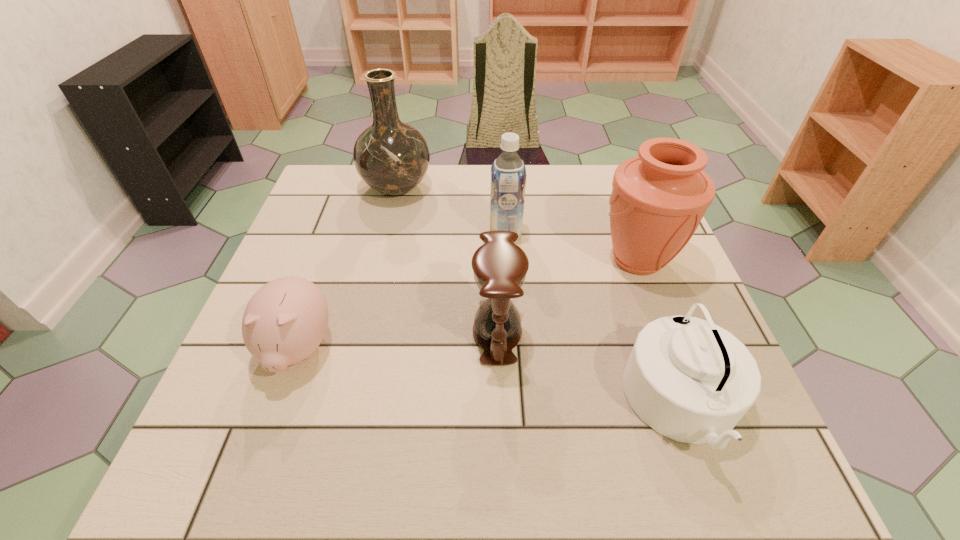
Image resolution: width=960 pixels, height=540 pixels. I want to click on free location at the near right corner of the desktop, so click(x=711, y=490).

You are a GUI agent. You are given a task and a screenshot of the screen. Output one action in this format:
    pyautogui.click(x=<x>, y=<y>)
    Task: Click on the empty space between the piggy bank and the hourglass
    This screenshot has height=540, width=960.
    Given the screenshot: What is the action you would take?
    pyautogui.click(x=397, y=341)

Where is `vacant space that's between the farthest object and the kettle`? vacant space that's between the farthest object and the kettle is located at coordinates (540, 296).

The width and height of the screenshot is (960, 540). What are the coordinates of `free space that is in between the left vase and the hourglass` in the screenshot? It's located at (447, 260).

Locate an element on the screen. vacant space in between the shortest object and the farthest object is located at coordinates (348, 268).

This screenshot has width=960, height=540. Identify the location of empty space between the piggy bank and the kettle. (491, 377).

Locate which object ranks fifth in proximity to the farthest object. Please provide its 2D coordinates. Your answer should be formatted as a tuple, i.e. [(x, y)], where the tuple contains the x and y coordinates of a point satisfying the conditions above.

[(690, 380)]

What are the coordinates of `object that is the fourth closest to the nearer vase` in the screenshot? It's located at (392, 157).

You are a GUI agent. You are given a task and a screenshot of the screen. Output one action in this format:
    pyautogui.click(x=<x>, y=<y>)
    Task: Click on the free space that satisfies the following two spatial constraints: 1. on the label of the soya milk; 2. on the left side of the nearer vase
    The height and width of the screenshot is (540, 960).
    Given the screenshot: What is the action you would take?
    (x=507, y=260)

The height and width of the screenshot is (540, 960). Identify the location of free space that satisfies the following two spatial constraints: 1. on the label of the soya milk; 2. on the left side of the right vase. (507, 260).